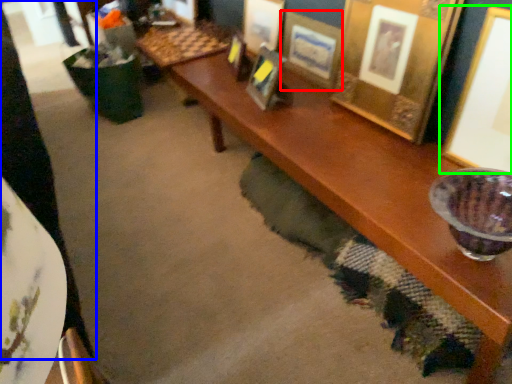
Question: Which object is positioned farthest from picture frame (highlighted by a red box)? Select from person (highlighted by a blue box) and picture frame (highlighted by a green box).

Choices:
 (A) person
 (B) picture frame

Answer: (A)